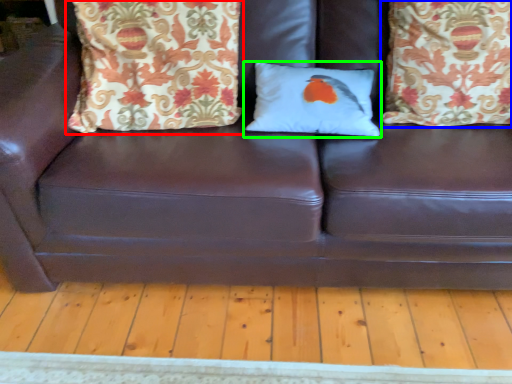
Question: Based on their relative distances, which object is nearer to pillow (highlighted by a red box)? Choose from pillow (highlighted by a blue box) and pillow (highlighted by a green box).

Choices:
 (A) pillow
 (B) pillow

Answer: (B)